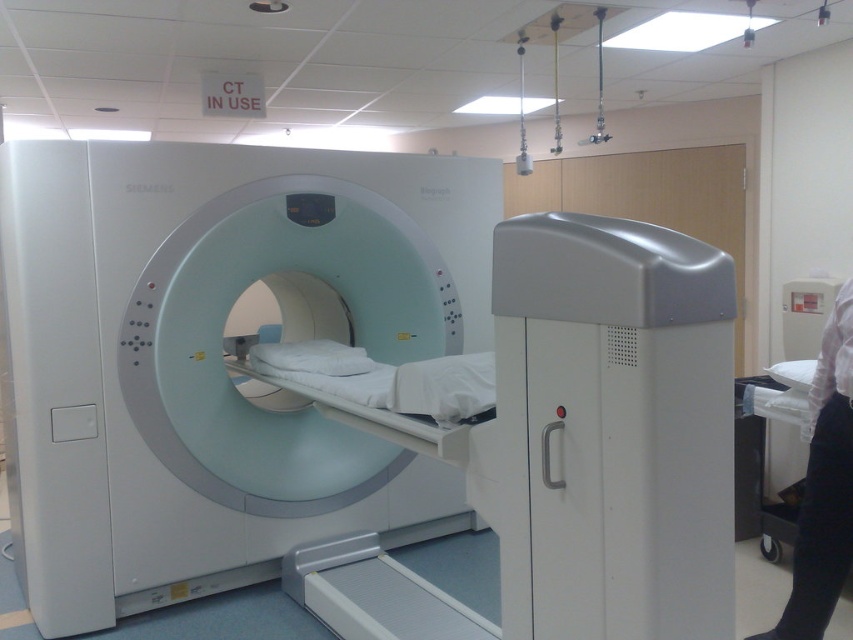
Is white plastic mri scanner at center bigger than white glossy bed at center?

Indeed, white plastic mri scanner at center has a larger size compared to white glossy bed at center.

Between white plastic mri scanner at center and white glossy bed at center, which one has more height?

With more height is white plastic mri scanner at center.

What do you see at coordinates (215, 356) in the screenshot? I see `white plastic mri scanner at center` at bounding box center [215, 356].

This screenshot has width=853, height=640. Identify the location of white plastic mri scanner at center. (215, 356).